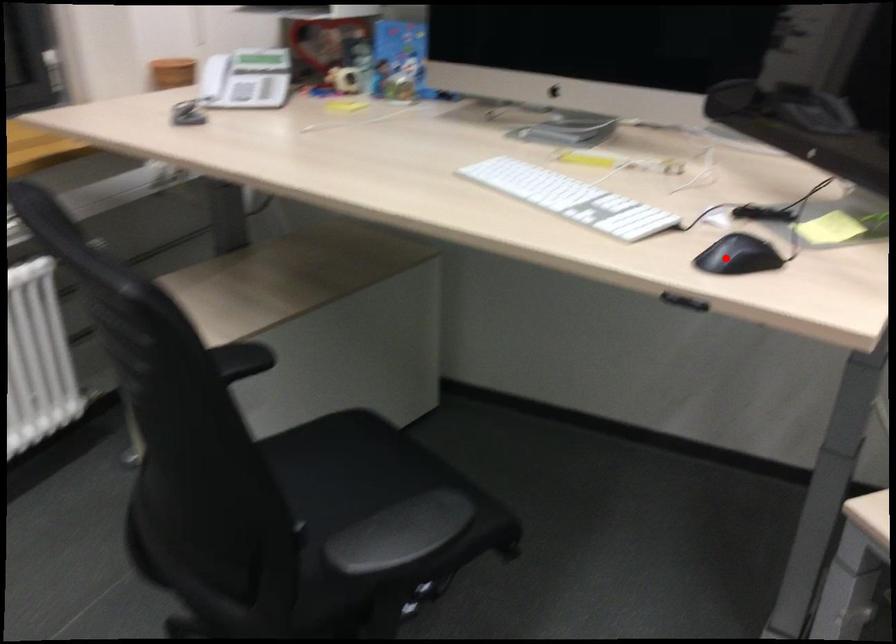
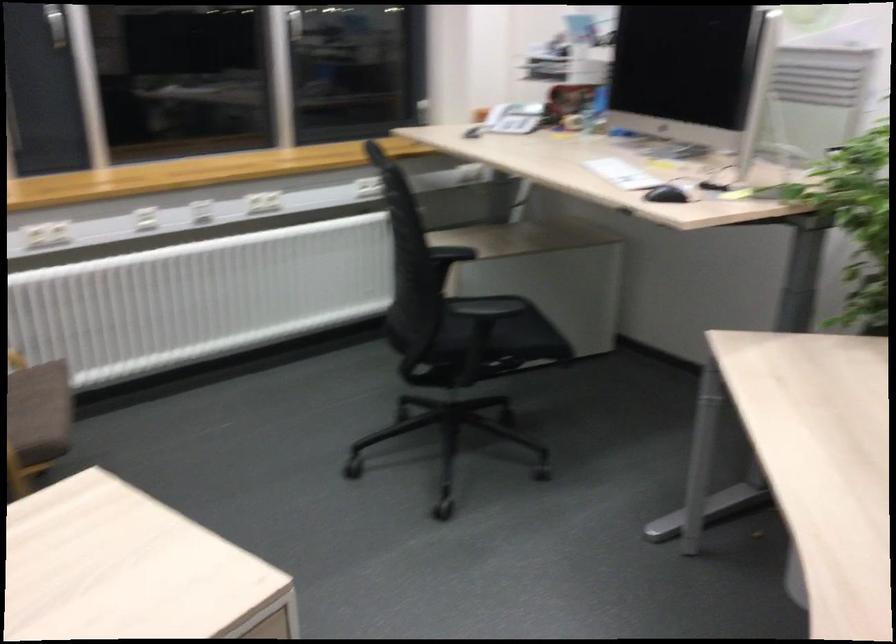
In the second image, find the point that corresponds to the highlighted location in the first image.

(666, 194)